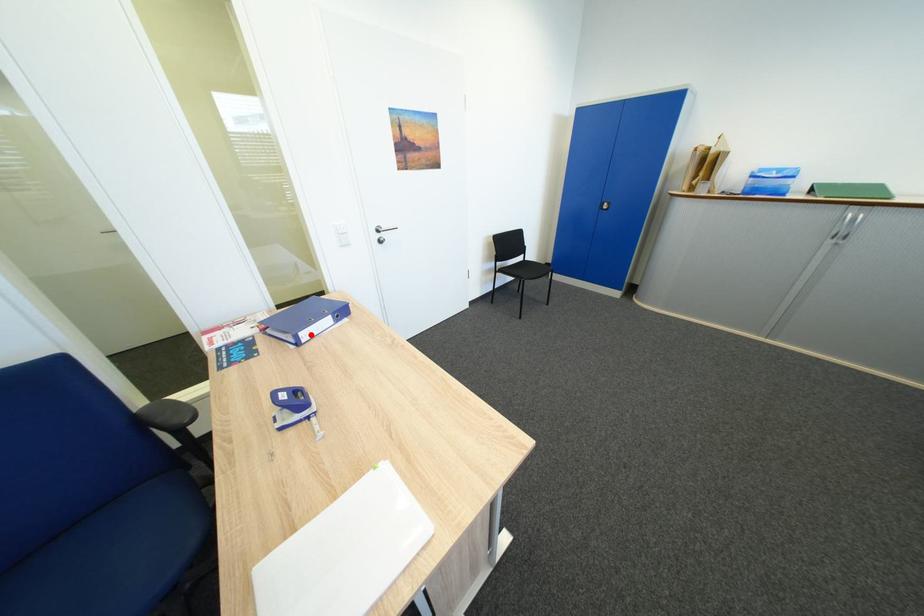
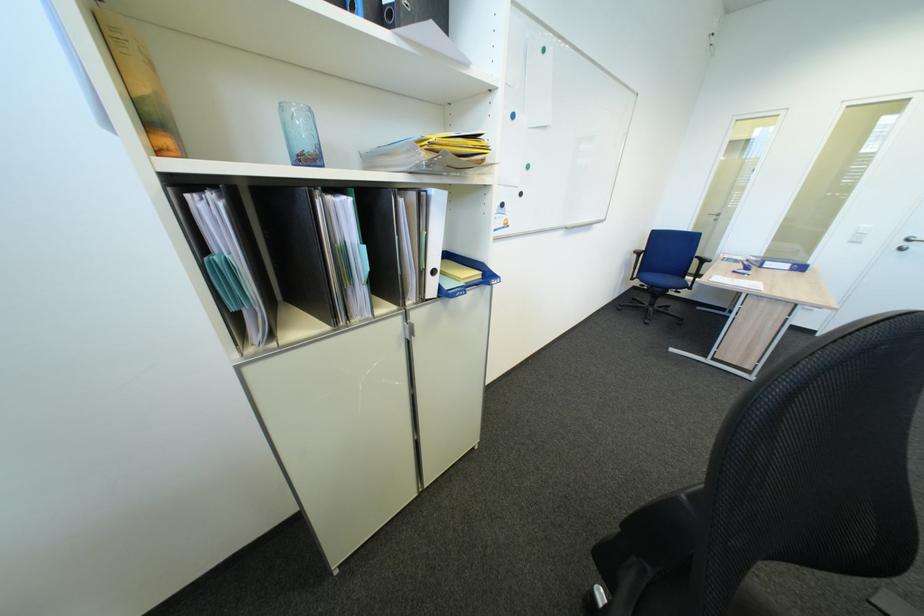
Locate, in the second image, the point that corresponds to the highlighted location in the first image.

(776, 264)